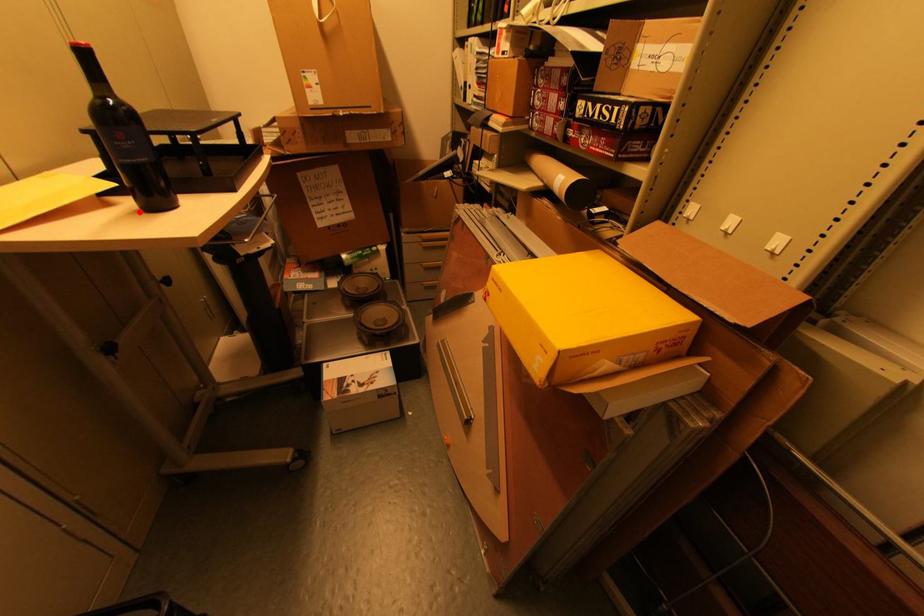
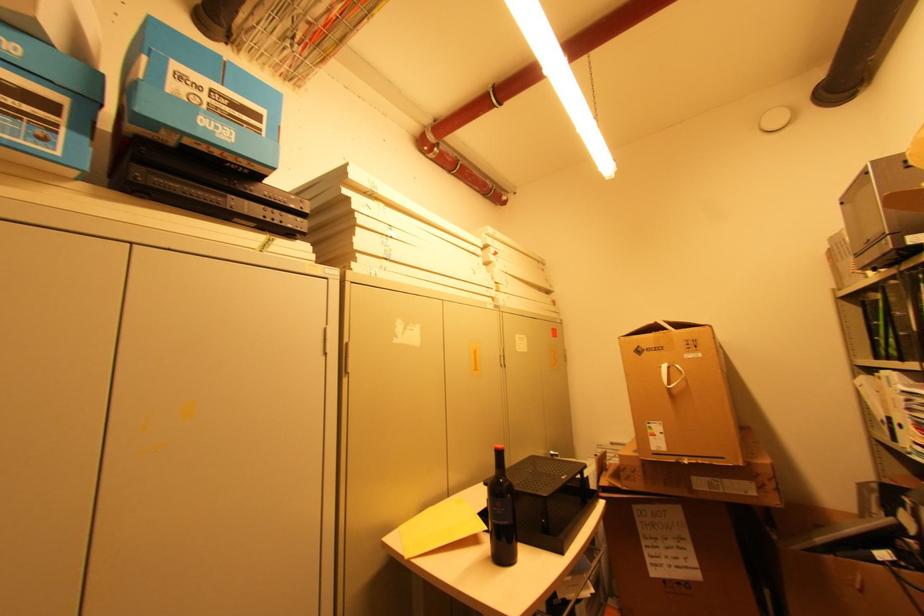
Locate, in the second image, the point that corresponds to the highlighted location in the first image.

(492, 559)